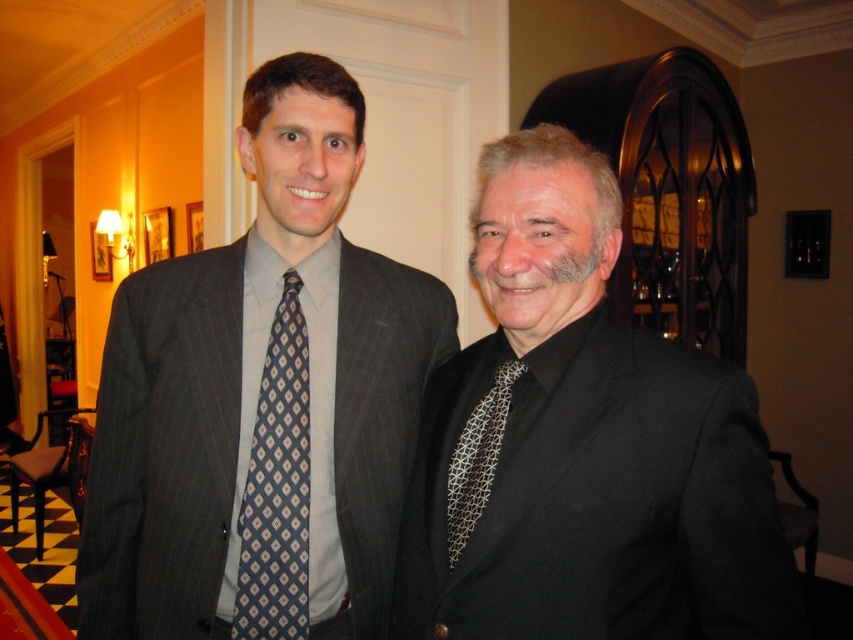
Who is more distant from viewer, [674,401] or [286,433]?

The point [286,433] is behind.

Is black silk suit at center smaller than blue printed tie at left?

No, black silk suit at center is not smaller than blue printed tie at left.

The width and height of the screenshot is (853, 640). In order to click on black silk suit at center in this screenshot , I will do `click(582, 445)`.

Is point (453, 502) behind point (486, 481)?

Yes, it is behind point (486, 481).

Does point (694, 483) come closer to viewer compared to point (476, 426)?

Yes, point (694, 483) is in front of point (476, 426).

This screenshot has height=640, width=853. In order to click on black silk suit at center in this screenshot , I will do `click(582, 445)`.

Is blue printed tie at left to the right of black textured tie at center from the viewer's perspective?

In fact, blue printed tie at left is to the left of black textured tie at center.

Is blue printed tie at left smaller than black textured tie at center?

No.

Find the location of a particular element. This screenshot has height=640, width=853. blue printed tie at left is located at coordinates (277, 486).